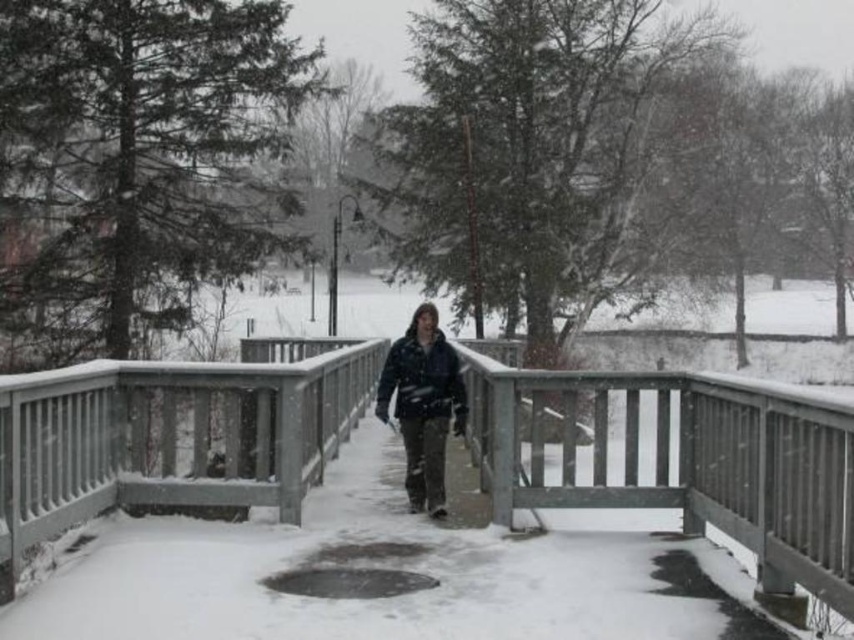
Can you confirm if wooden bridge at center is smaller than dark blue jacket at center?

Actually, wooden bridge at center might be larger than dark blue jacket at center.

Who is higher up, wooden bridge at center or dark blue jacket at center?

dark blue jacket at center

Identify the location of wooden bridge at center. (676, 458).